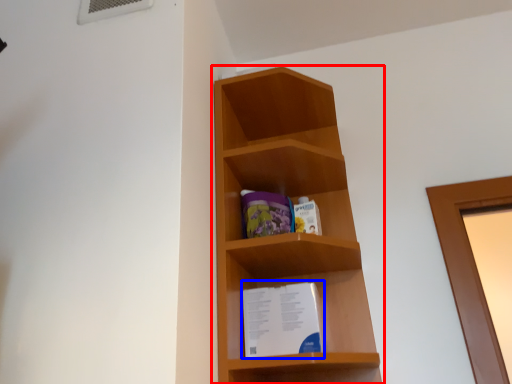
Question: Which of the following is the farthest to the observer, shelf (highlighted by a red box) or paperback book (highlighted by a blue box)?

Choices:
 (A) shelf
 (B) paperback book

Answer: (B)